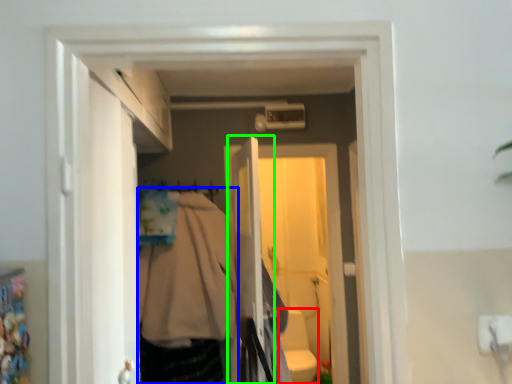
Question: Which object is positioned closest to toilet bowl (highlighted by a red box)? Select from clothing (highlighted by a blue box) and screen door (highlighted by a green box).

Choices:
 (A) clothing
 (B) screen door

Answer: (A)